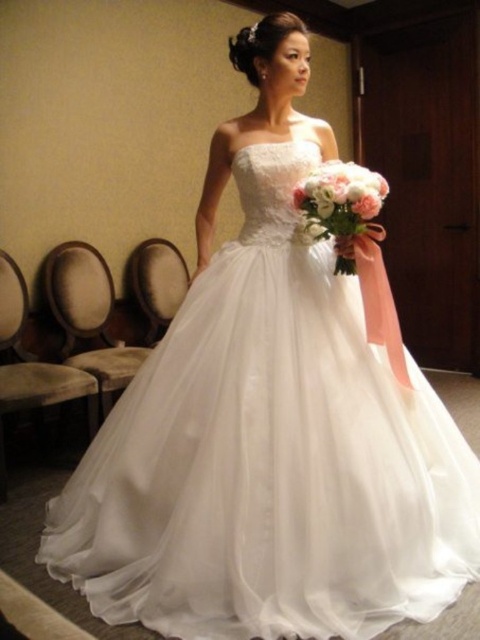
Question: Among these points, which one is nearest to the camera?

Choices:
 (A) (370, 204)
 (B) (349, 305)

Answer: (A)

Question: Does white tulle dress at center appear on the right side of white silk bouquet at center?

Choices:
 (A) yes
 (B) no

Answer: (B)

Question: Is white tulle dress at center positioned in front of white silk bouquet at center?

Choices:
 (A) no
 (B) yes

Answer: (B)

Question: Considering the relative positions of white tulle dress at center and white silk bouquet at center in the image provided, where is white tulle dress at center located with respect to white silk bouquet at center?

Choices:
 (A) right
 (B) left

Answer: (B)

Question: Which point is farther to the camera?

Choices:
 (A) white silk bouquet at center
 (B) white tulle dress at center

Answer: (A)